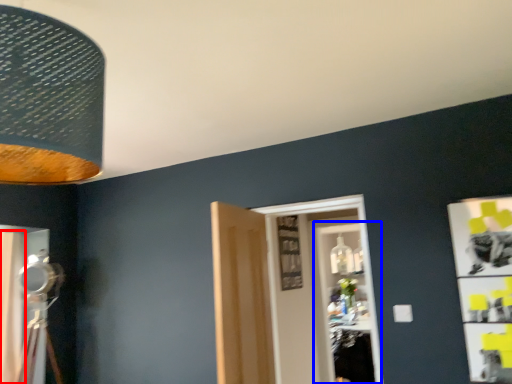
Question: Among these objects, which one is farthest to the camera, curtain (highlighted by a red box) or glass door (highlighted by a blue box)?

Choices:
 (A) curtain
 (B) glass door

Answer: (B)